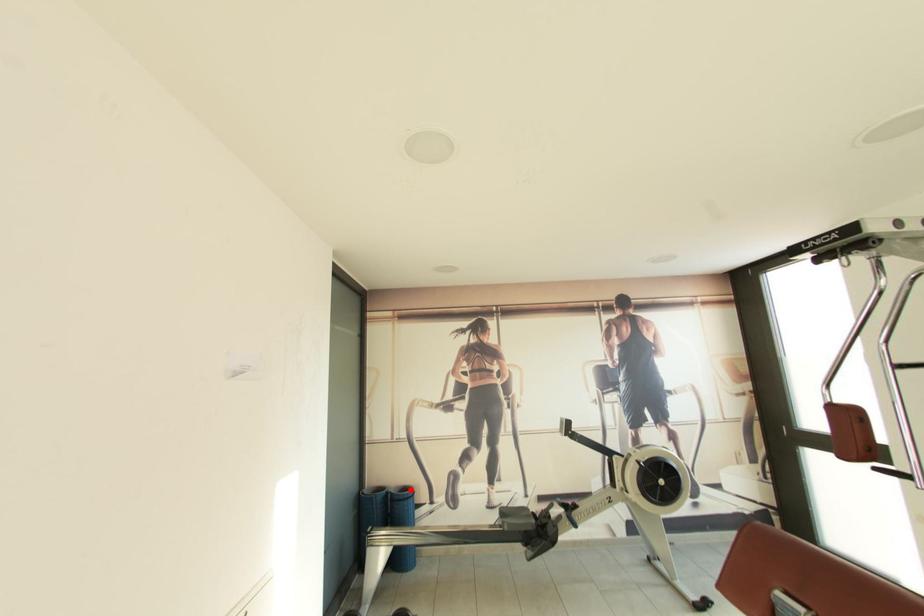
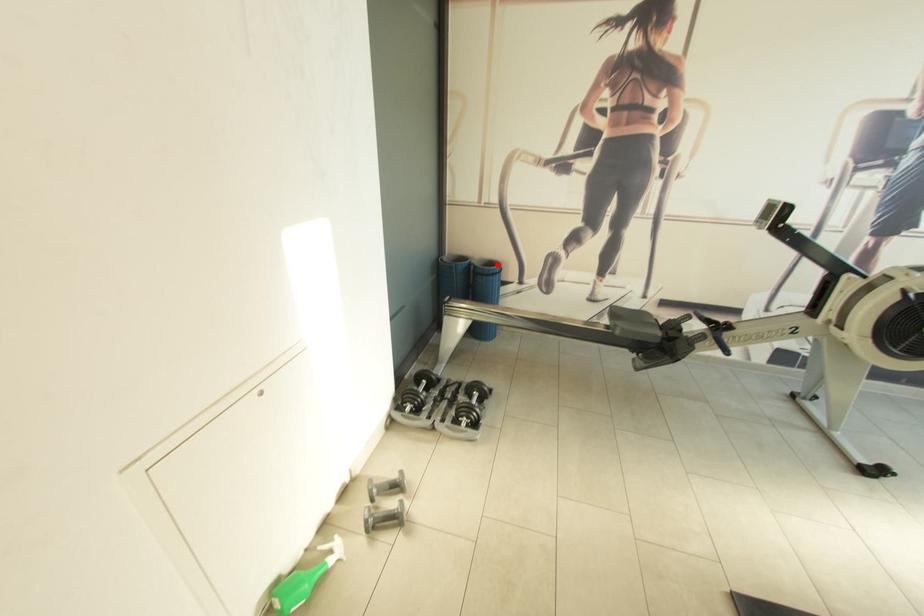
I am providing you with two images of the same scene from different viewpoints. A red point is marked on the first image and another point is marked on the second image. Does the point marked in image1 correspond to the same location as the one in image2?

Yes